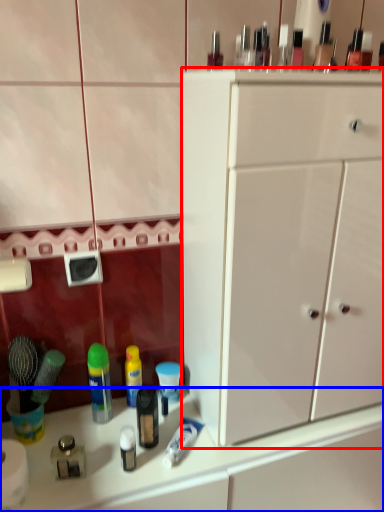
Question: Which object appears closest to the camera in this image, cabinetry (highlighted by a red box) or counter top (highlighted by a blue box)?

Choices:
 (A) cabinetry
 (B) counter top

Answer: (A)